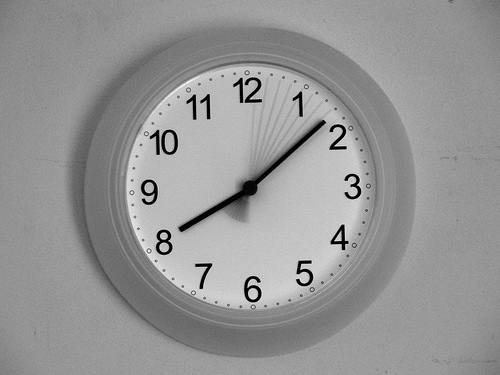
Identify the location of wall. This screenshot has width=500, height=375. (444, 283).